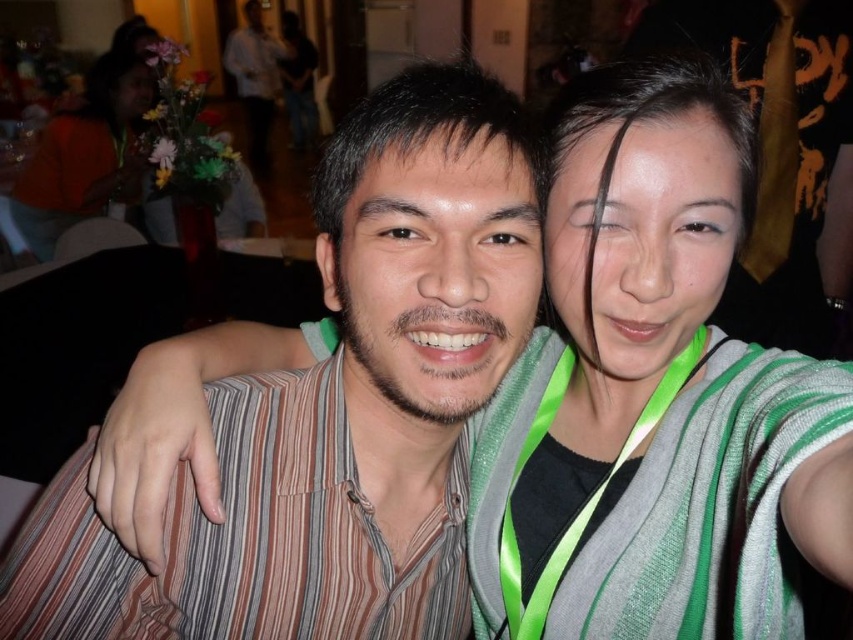
Does green striped sweater at center have a larger size compared to striped shirt at center?

Incorrect, green striped sweater at center is not larger than striped shirt at center.

How distant is green striped sweater at center from striped shirt at center?

green striped sweater at center and striped shirt at center are 16.30 centimeters apart.

Who is more distant from viewer, (x=602, y=333) or (x=360, y=234)?

The point (x=602, y=333) is more distant.

At what (x,y) coordinates should I click in order to perform the action: click on green striped sweater at center. Please return your answer as a coordinate pair (x, y). This screenshot has width=853, height=640. Looking at the image, I should click on (653, 396).

What do you see at coordinates (653, 396) in the screenshot? This screenshot has height=640, width=853. I see `green striped sweater at center` at bounding box center [653, 396].

Does green striped sweater at center have a greater height compared to orange fabric at upper left?

No.

Describe the element at coordinates (653, 396) in the screenshot. I see `green striped sweater at center` at that location.

This screenshot has width=853, height=640. Find the location of `green striped sweater at center`. green striped sweater at center is located at coordinates (653, 396).

Is striped shirt at center taller than orange fabric at upper left?

No, striped shirt at center is not taller than orange fabric at upper left.

Between point (102, 620) and point (100, 60), which one is positioned in front?

Point (102, 620) is in front.

This screenshot has width=853, height=640. Describe the element at coordinates (335, 406) in the screenshot. I see `striped shirt at center` at that location.

You are a GUI agent. You are given a task and a screenshot of the screen. Output one action in this format:
    pyautogui.click(x=<x>, y=<y>)
    Task: Click on the striped shirt at center
    The height and width of the screenshot is (640, 853).
    Given the screenshot: What is the action you would take?
    pyautogui.click(x=335, y=406)